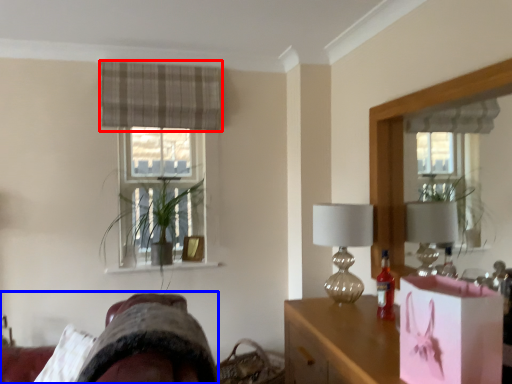
Question: Which object is closer to the camera taking this photo, curtain (highlighted by a red box) or swivel chair (highlighted by a blue box)?

Choices:
 (A) curtain
 (B) swivel chair

Answer: (B)